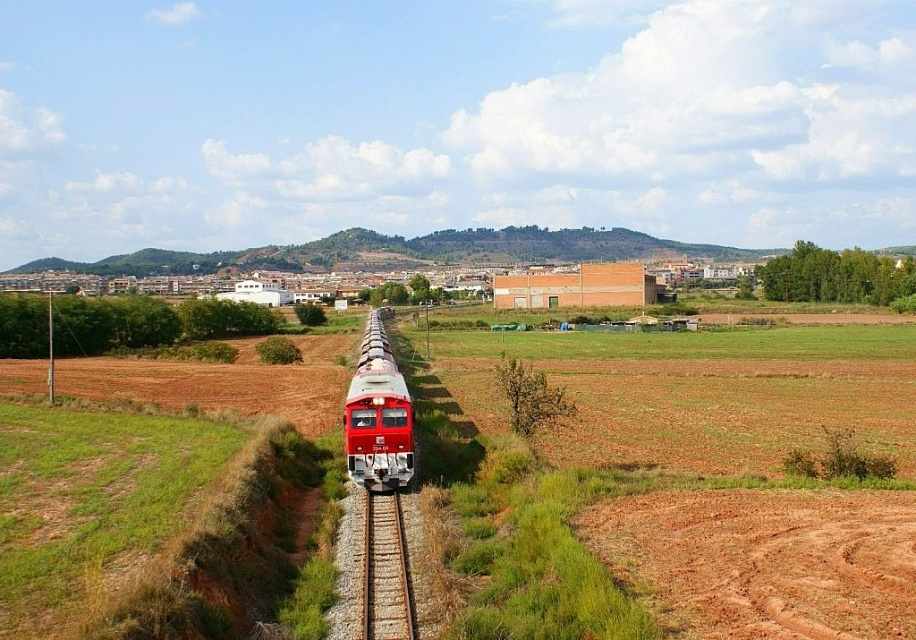
Is rusty metal train track at center in front of matte red train at center?

Yes, rusty metal train track at center is closer to the viewer.

Between rusty metal train track at center and matte red train at center, which one appears on the right side from the viewer's perspective?

From the viewer's perspective, rusty metal train track at center appears more on the right side.

The height and width of the screenshot is (640, 916). Describe the element at coordinates (380, 568) in the screenshot. I see `rusty metal train track at center` at that location.

You are a GUI agent. You are given a task and a screenshot of the screen. Output one action in this format:
    pyautogui.click(x=<x>, y=<y>)
    Task: Click on the rusty metal train track at center
    This screenshot has height=640, width=916.
    Given the screenshot: What is the action you would take?
    pyautogui.click(x=380, y=568)

Is point (707, 621) behind point (373, 614)?

No, (707, 621) is closer to viewer.

Looking at this image, is red clay dirt track at lower right below rusty metal train track at center?

No.

Image resolution: width=916 pixels, height=640 pixels. Find the location of `red clay dirt track at lower right`. red clay dirt track at lower right is located at coordinates (764, 561).

Locate an element on the screen. Image resolution: width=916 pixels, height=640 pixels. red clay dirt track at lower right is located at coordinates (764, 561).

Does point (691, 552) lie in front of point (355, 392)?

Yes, it is.

Which of these two, red clay dirt track at lower right or matte red train at center, stands taller?

With more height is matte red train at center.

I want to click on red clay dirt track at lower right, so click(764, 561).

Where is `red clay dirt track at lower right`? This screenshot has height=640, width=916. red clay dirt track at lower right is located at coordinates (764, 561).